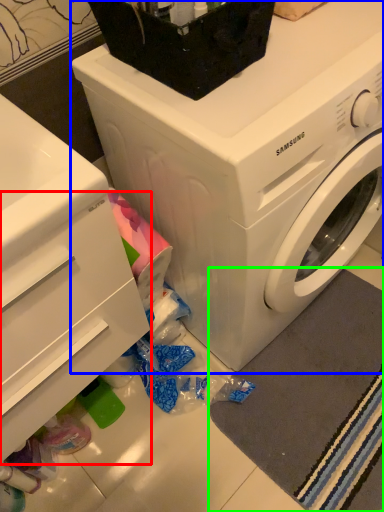
Question: Which is nearer to the drawer (highlighted by a red box)? washing machine (highlighted by a blue box) or bath mat (highlighted by a green box).

Choices:
 (A) washing machine
 (B) bath mat

Answer: (A)